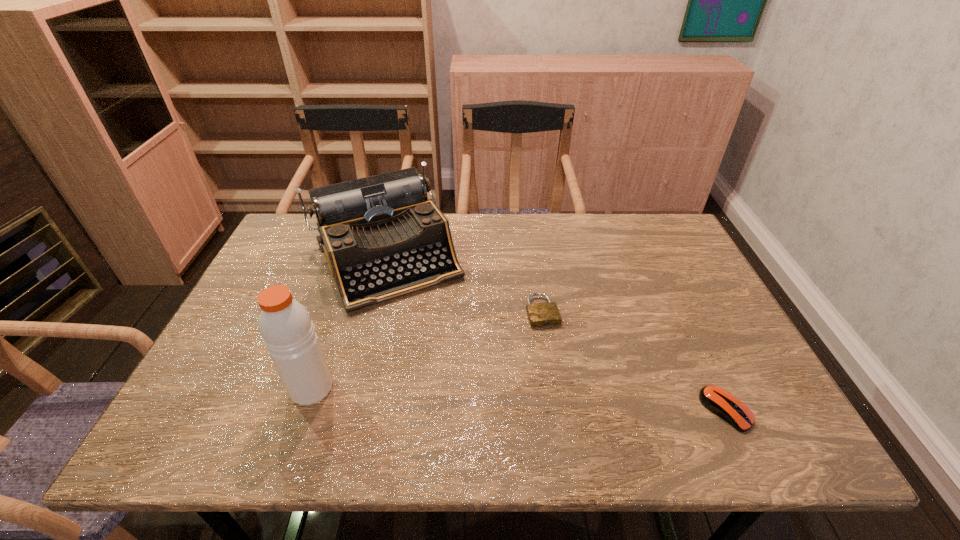
Where is `vacant area that lies between the shaker and the padlock`? vacant area that lies between the shaker and the padlock is located at coordinates (427, 350).

This screenshot has height=540, width=960. Identify the location of free space between the computer mouse and the padlock. (634, 361).

I want to click on unoccupied position between the shaker and the second object from right to left, so (x=427, y=350).

Where is `free area in between the shaker and the shortest object`? The image size is (960, 540). free area in between the shaker and the shortest object is located at coordinates (427, 350).

Identify the location of free spot between the typewriter and the tallest object. (348, 323).

Locate which object is the third closest to the shaker. Please provide its 2D coordinates. Your answer should be formatted as a tuple, i.e. [(x, y)], where the tuple contains the x and y coordinates of a point satisfying the conditions above.

[(720, 402)]

Identify which object is the third closest to the tallest object. Please provide its 2D coordinates. Your answer should be formatted as a tuple, i.e. [(x, y)], where the tuple contains the x and y coordinates of a point satisfying the conditions above.

[(720, 402)]

Where is `vacant space that satisfies the following two spatial constraints: 1. on the front side of the rightmost object; 2. on the left side of the second tallest object`? vacant space that satisfies the following two spatial constraints: 1. on the front side of the rightmost object; 2. on the left side of the second tallest object is located at coordinates (346, 410).

What are the coordinates of `vacant point that satisfies the following two spatial constraints: 1. on the front side of the typewriter; 2. on the right side of the padlock` in the screenshot? It's located at (372, 312).

Find the location of a particular element. free point that satisfies the following two spatial constraints: 1. on the back side of the shaker; 2. on the right side of the third shortest object is located at coordinates (356, 258).